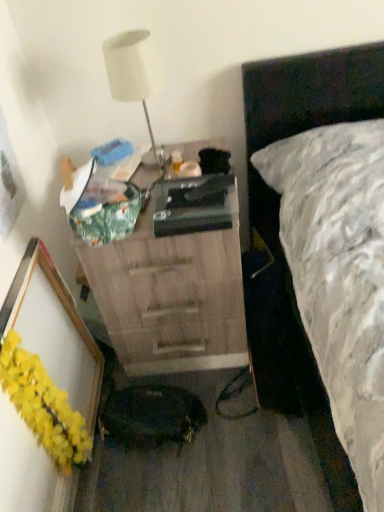
Question: In the image, is wooden chest of drawers at center on the left side or the right side of yellow fluffy garland at lower left?

Choices:
 (A) right
 (B) left

Answer: (A)

Question: Is wooden chest of drawers at center taller or shorter than yellow fluffy garland at lower left?

Choices:
 (A) tall
 (B) short

Answer: (A)

Question: Which is nearer to the wooden chest of drawers at center?

Choices:
 (A) white matte lamp at upper left
 (B) yellow fluffy garland at lower left

Answer: (A)

Question: Based on their relative distances, which object is nearer to the white matte lamp at upper left?

Choices:
 (A) yellow fluffy garland at lower left
 (B) wooden chest of drawers at center

Answer: (B)